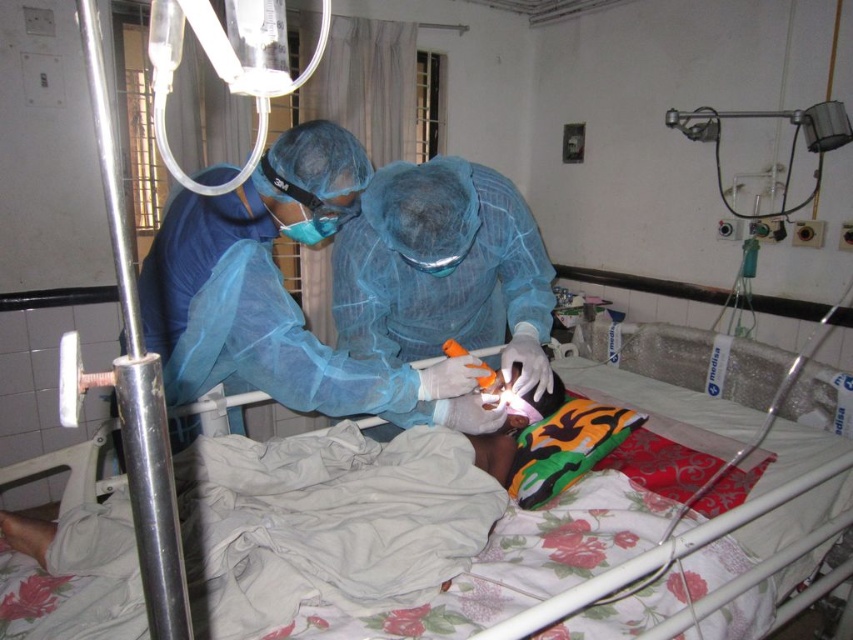
Question: Can you confirm if floral fabric hospital bed at center is positioned above blue mesh gown at center?

Choices:
 (A) no
 (B) yes

Answer: (A)

Question: Does floral fabric hospital bed at center have a smaller size compared to blue mesh gown at center?

Choices:
 (A) no
 (B) yes

Answer: (A)

Question: Can you confirm if floral fabric hospital bed at center is thinner than blue mesh gown at center?

Choices:
 (A) yes
 (B) no

Answer: (B)

Question: Which object is closer to the camera taking this photo?

Choices:
 (A) blue mesh gown at center
 (B) floral fabric hospital bed at center

Answer: (B)

Question: Which point is farther from the camera taking this photo?

Choices:
 (A) (480, 326)
 (B) (595, 497)

Answer: (A)